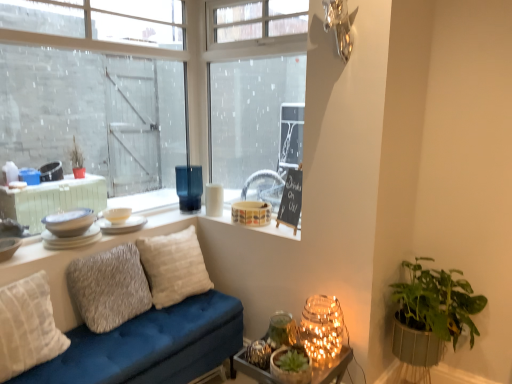
Question: Considering their positions, is green leafy plant in woven basket at lower right, arranged as the second houseplant when viewed from the left, located in front of or behind matte ceramic bowl at upper center, positioned as the 1th candle holder in right-to-left order?

Choices:
 (A) front
 (B) behind

Answer: (A)

Question: Is green leafy plant in woven basket at lower right, which is counted as the 1th houseplant, starting from the right, bigger or smaller than matte ceramic bowl at upper center, marked as the 3th candle holder in a left-to-right arrangement?

Choices:
 (A) big
 (B) small

Answer: (A)

Question: Estimate the real-world distances between objects in this image. Which object is closer to the matte white plates at window sill, the first tableware in the front-to-back sequence?

Choices:
 (A) matte white plate at upper left, which appears as the third tableware when viewed from the front
 (B) textured gray pillow at center, marked as the 2th pillow in a back-to-front arrangement
 (C) white textured pillow at left, which ranks as the first pillow in front-to-back order
 (D) green textured pot at lower right, the 2th houseplant when ordered from right to left
 (E) translucent glass vase at window, placed as the 1th candle holder when sorted from left to right

Answer: (A)

Question: Estimate the real-world distances between objects in this image. Which object is closer to the black chalkboard at upper center?

Choices:
 (A) white glossy bowls at upper left, the 3th tableware positioned from the back
 (B) transparent glass window at upper left, arranged as the 1th window when viewed from the top
 (C) illuminated glass jar at lower right, the 2th table in the bottom-to-top sequence
 (D) translucent glass candle holder at lower right, which ranks as the second table in top-to-bottom order
 (E) matte white plate at upper left, the second tableware viewed from the back

Answer: (C)